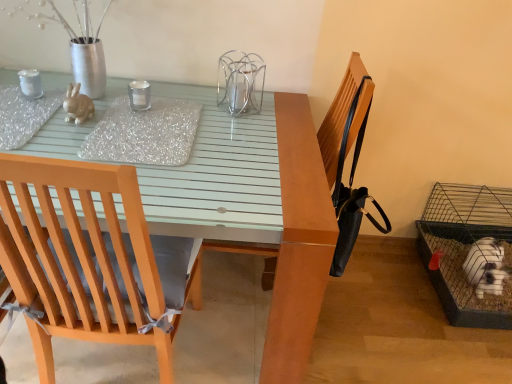
At what (x,y) coordinates should I click in order to perform the action: click on wooden chair at left. Please return your answer as a coordinate pair (x, y). This screenshot has width=512, height=384. Looking at the image, I should click on (90, 259).

This screenshot has width=512, height=384. I want to click on clear glass candle holder at center, which appears as the 1th bird cage when viewed from the left, so click(x=240, y=80).

What do you see at coordinates (139, 95) in the screenshot?
I see `clear glass candle at center` at bounding box center [139, 95].

This screenshot has width=512, height=384. Describe the element at coordinates (256, 208) in the screenshot. I see `matte glass table at center` at that location.

At what (x,y) coordinates should I click in order to perform the action: click on black leather chair at upper right. Please return your answer as a coordinate pair (x, y). The height and width of the screenshot is (384, 512). Looking at the image, I should click on (345, 124).

Locate an element on the screen. The width and height of the screenshot is (512, 384). wire mesh cage at lower right, which is the first bird cage from back to front is located at coordinates (466, 249).

This screenshot has height=384, width=512. Find the location of `wooden chair at left`. wooden chair at left is located at coordinates (90, 259).

Can you confirm if matte glass table at center is bigger than black leather chair at upper right?

Correct, matte glass table at center is larger in size than black leather chair at upper right.

From the image's perspective, is matte glass table at center located beneath black leather chair at upper right?

Correct, matte glass table at center appears lower than black leather chair at upper right in the image.

Which object is positioned more to the right, matte glass table at center or black leather chair at upper right?

black leather chair at upper right.

In terms of width, does matte glass table at center look wider or thinner when compared to black leather chair at upper right?

matte glass table at center is wider than black leather chair at upper right.

Does matte ceramic rabbit at upper left turn towards matte glass table at center?

No.

From a real-world perspective, is matte ceramic rabbit at upper left above or below matte glass table at center?

matte ceramic rabbit at upper left is situated higher than matte glass table at center in the real world.

Which point is more forward, (80, 99) or (282, 338)?

The point (282, 338) is closer to the camera.

This screenshot has height=384, width=512. Identify the location of candle holder lying on the right of matte ceramic rabbit at upper left. (139, 95).

How many degrees apart are the facing directions of clear glass candle at center and matte ceramic rabbit at upper left?

clear glass candle at center and matte ceramic rabbit at upper left are facing 0.00013 degrees away from each other.

Is clear glass candle at center next to matte ceramic rabbit at upper left?

No, clear glass candle at center is not making contact with matte ceramic rabbit at upper left.

How much distance is there between clear glass candle at center and matte ceramic rabbit at upper left?

They are 6.48 inches apart.

Does clear glass candle holder at center, which is the 1th bird cage from front to back, have a smaller size compared to wire mesh cage at lower right, which is the first bird cage from back to front?

Yes.

In the scene shown: From a real-world perspective, is clear glass candle holder at center, which is the second bird cage in back-to-front order, positioned under wire mesh cage at lower right, positioned as the 1th bird cage in bottom-to-top order, based on gravity?

No, from a real-world perspective, clear glass candle holder at center, which is the second bird cage in back-to-front order, is not below wire mesh cage at lower right, positioned as the 1th bird cage in bottom-to-top order.

The width and height of the screenshot is (512, 384). I want to click on bird cage positioned vertically above the wire mesh cage at lower right, positioned as the 1th bird cage in bottom-to-top order (from a real-world perspective), so click(x=240, y=80).

Can you confirm if clear glass candle holder at center, which is the 1th bird cage from front to back, is wider than wire mesh cage at lower right, positioned as the 1th bird cage in bottom-to-top order?

No, clear glass candle holder at center, which is the 1th bird cage from front to back, is not wider than wire mesh cage at lower right, positioned as the 1th bird cage in bottom-to-top order.

Considering the positions of points (431, 209) and (132, 260), is point (431, 209) farther from camera compared to point (132, 260)?

Yes, point (431, 209) is behind point (132, 260).

Looking at their sizes, would you say wire mesh cage at lower right, which is the second bird cage in top-to-bottom order, is wider or thinner than wooden chair at left?

Clearly, wire mesh cage at lower right, which is the second bird cage in top-to-bottom order, has more width compared to wooden chair at left.

Is wire mesh cage at lower right, positioned as the 1th bird cage in bottom-to-top order, not close to wooden chair at left?

Indeed, wire mesh cage at lower right, positioned as the 1th bird cage in bottom-to-top order, is not near wooden chair at left.

Which object is positioned more to the left, wire mesh cage at lower right, marked as the 2th bird cage in a front-to-back arrangement, or wooden chair at left?

Positioned to the left is wooden chair at left.

Would you say matte glass table at center is part of wire mesh cage at lower right, positioned as the 1th bird cage in bottom-to-top order,'s contents?

That's incorrect, matte glass table at center is not inside wire mesh cage at lower right, positioned as the 1th bird cage in bottom-to-top order.

Measure the distance between wire mesh cage at lower right, acting as the 2th bird cage starting from the left, and matte glass table at center.

A distance of 1.06 meters exists between wire mesh cage at lower right, acting as the 2th bird cage starting from the left, and matte glass table at center.

From a real-world perspective, which object rests below the other?

In real-world perspective, wire mesh cage at lower right, which is the first bird cage from back to front, is lower.

Does wire mesh cage at lower right, which is the second bird cage in top-to-bottom order, have a lesser width compared to matte glass table at center?

Indeed, wire mesh cage at lower right, which is the second bird cage in top-to-bottom order, has a lesser width compared to matte glass table at center.

Does wooden chair at left have a lesser height compared to clear glass candle at center?

Incorrect, the height of wooden chair at left does not fall short of that of clear glass candle at center.

Is wooden chair at left positioned far away from clear glass candle at center?

No, wooden chair at left is in close proximity to clear glass candle at center.

From a real-world perspective, is wooden chair at left positioned over clear glass candle at center based on gravity?

No.

At what (x,y) coordinates should I click in order to perform the action: click on armchair above the matte glass table at center (from a real-world perspective). Please return your answer as a coordinate pair (x, y). The height and width of the screenshot is (384, 512). Looking at the image, I should click on (345, 124).

Locate an element on the screen. The height and width of the screenshot is (384, 512). animal behind the matte glass table at center is located at coordinates (77, 105).

Based on their spatial positions, is clear glass candle at center or wire mesh cage at lower right, acting as the 2th bird cage starting from the left, closer to matte ceramic rabbit at upper left?

clear glass candle at center is positioned closer to the anchor matte ceramic rabbit at upper left.

From the image, which object appears to be farther from clear glass candle at center, matte glass table at center or matte ceramic rabbit at upper left?

Among the two, matte glass table at center is located further to clear glass candle at center.

From the image, which object appears to be nearer to clear glass candle at center, wire mesh cage at lower right, acting as the 2th bird cage starting from the left, or matte ceramic rabbit at upper left?

Based on the image, matte ceramic rabbit at upper left appears to be nearer to clear glass candle at center.

Which object lies nearer to the anchor point clear glass candle holder at center, which is the 1th bird cage from front to back, matte glass table at center or clear glass candle at center?

clear glass candle at center.

Based on their spatial positions, is clear glass candle at center or matte glass table at center closer to wooden chair at left?

matte glass table at center is closer to wooden chair at left.

From the image, which object appears to be nearer to black leather chair at upper right, wire mesh cage at lower right, marked as the 2th bird cage in a front-to-back arrangement, or clear glass candle at center?

clear glass candle at center lies closer to black leather chair at upper right than the other object.

Which object lies nearer to the anchor point black leather chair at upper right, clear glass candle at center or wooden chair at left?

The object closer to black leather chair at upper right is clear glass candle at center.

Based on the photo, based on their spatial positions, is wire mesh cage at lower right, acting as the 2th bird cage starting from the left, or wooden chair at left further from clear glass candle holder at center, which appears as the 1th bird cage when viewed from the left?

wire mesh cage at lower right, acting as the 2th bird cage starting from the left, lies further to clear glass candle holder at center, which appears as the 1th bird cage when viewed from the left, than the other object.

The image size is (512, 384). Identify the location of animal between wooden chair at left and clear glass candle at center along the z-axis. (77, 105).

Where is `bird cage between matte ceramic rabbit at upper left and wire mesh cage at lower right, positioned as the 1th bird cage in bottom-to-top order, from left to right`? bird cage between matte ceramic rabbit at upper left and wire mesh cage at lower right, positioned as the 1th bird cage in bottom-to-top order, from left to right is located at coordinates (240, 80).

Locate an element on the screen. The width and height of the screenshot is (512, 384). armchair between wooden chair at left and clear glass candle at center along the z-axis is located at coordinates (345, 124).

You are a GUI agent. You are given a task and a screenshot of the screen. Output one action in this format:
    pyautogui.click(x=<x>, y=<y>)
    Task: Click on the bird cage between wooden chair at left and wire mesh cage at lower right, the first bird cage from the right, in the horizontal direction
    The height and width of the screenshot is (384, 512).
    Given the screenshot: What is the action you would take?
    pyautogui.click(x=240, y=80)